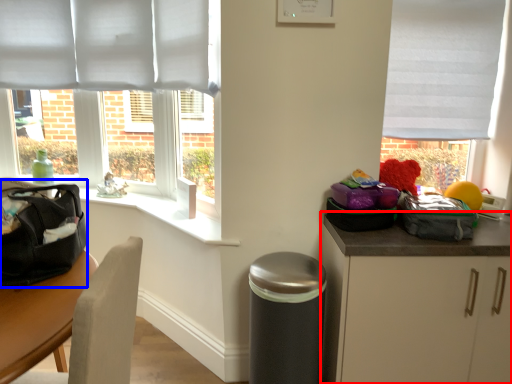
Question: Which point is closer to the camera, cabinetry (highlighted by a red box) or pack (highlighted by a blue box)?

Choices:
 (A) cabinetry
 (B) pack

Answer: (B)